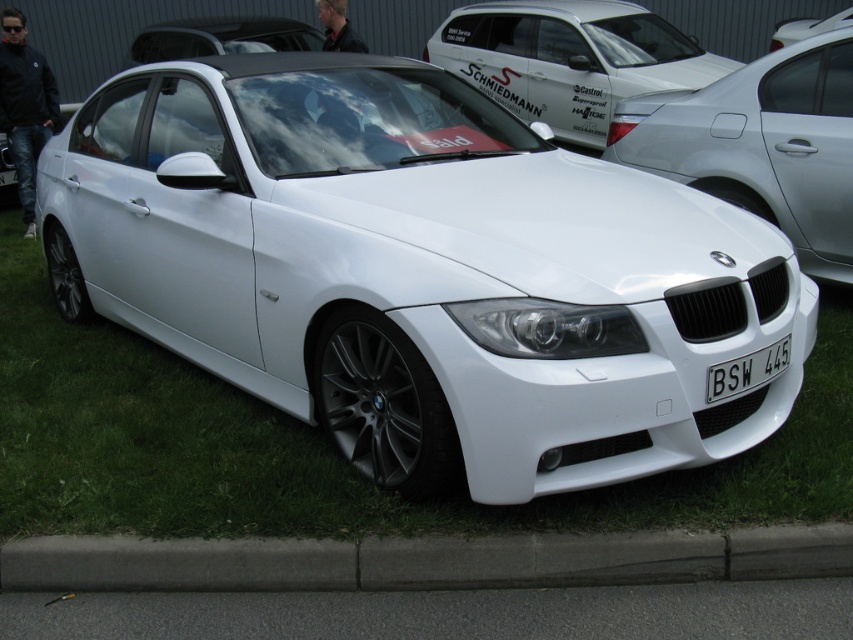
Question: Which object is farther from the camera taking this photo?

Choices:
 (A) white plastic license plate at center
 (B) white matte car at upper center
 (C) white glossy car at center
 (D) white glossy sedan at upper center

Answer: (B)

Question: Observing the image, what is the correct spatial positioning of white glossy sedan at center in reference to white glossy car at center?

Choices:
 (A) above
 (B) below

Answer: (B)

Question: Estimate the real-world distances between objects in this image. Which object is closer to the white glossy sedan at center?

Choices:
 (A) white matte car at upper center
 (B) white plastic license plate at center
 (C) white glossy sedan at upper center

Answer: (B)

Question: Estimate the real-world distances between objects in this image. Which object is closer to the white matte car at upper center?

Choices:
 (A) white glossy sedan at upper center
 (B) white glossy car at center
 (C) gray concrete curb at lower center

Answer: (A)

Question: In this image, where is gray concrete curb at lower center located relative to white matte car at upper center?

Choices:
 (A) left
 (B) right

Answer: (A)

Question: Can you confirm if gray concrete curb at lower center is positioned to the right of white glossy sedan at center?

Choices:
 (A) yes
 (B) no

Answer: (B)